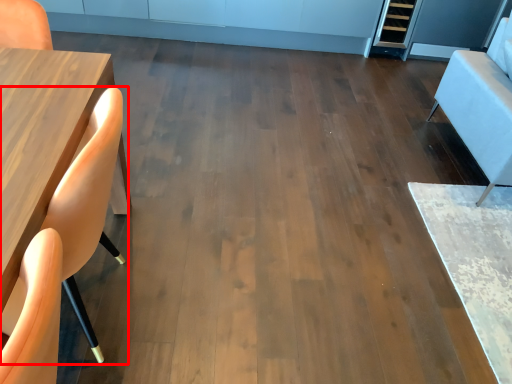
Question: Observing the image, what is the correct spatial positioning of chair (annotated by the red box) in reference to armchair?

Choices:
 (A) right
 (B) left

Answer: (B)